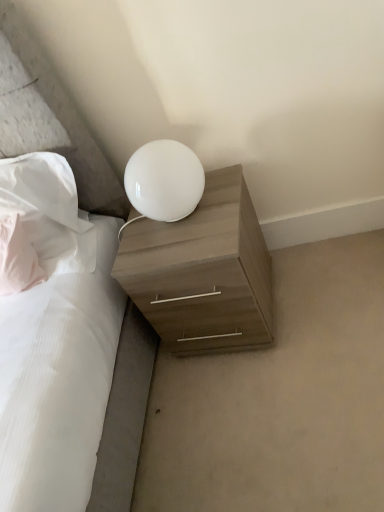
Identify the location of free location above light wood/texture nightstand at lower right (from a real-world perspective). This screenshot has width=384, height=512. (180, 229).